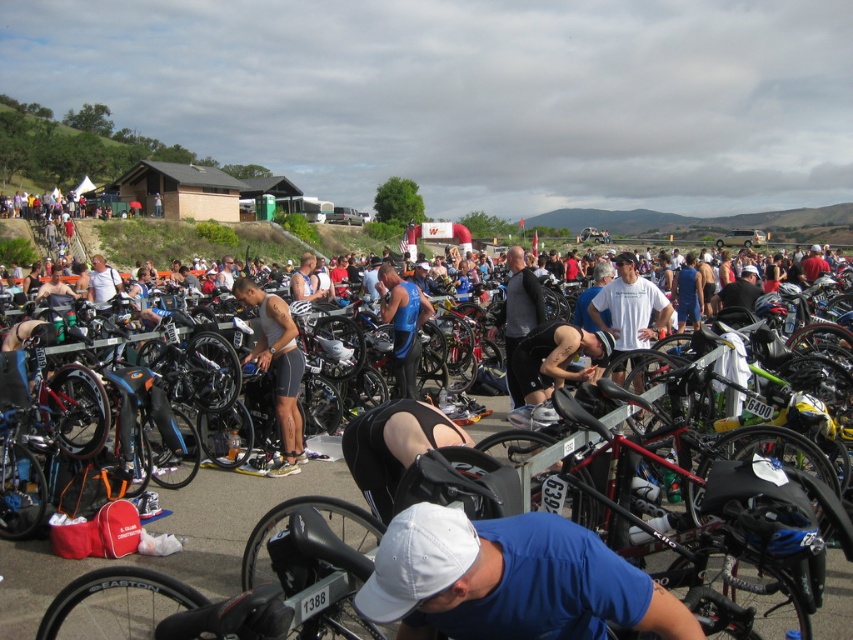
Does gray matte shorts at center have a larger size compared to black matte vest at center?

No.

Is point (268, 362) farther from viewer compared to point (511, 308)?

No.

This screenshot has width=853, height=640. Find the location of `gray matte shorts at center`. gray matte shorts at center is located at coordinates (277, 368).

This screenshot has width=853, height=640. Identify the location of gray matte shorts at center. (277, 368).

Between black matte helmet at center and black matte vest at center, which one has more height?

black matte vest at center is taller.

Is black matte helmet at center further to camera compared to black matte vest at center?

No, it is not.

Which is behind, point (364, 420) or point (518, 273)?

The point (518, 273) is behind.

Identify the location of black matte helmet at center. (393, 445).

Is point (524, 579) positioned behind point (397, 388)?

No.

Does blue fabric shirt at center have a greater width compared to blue fabric tank top at center?

Yes, blue fabric shirt at center is wider than blue fabric tank top at center.

Does point (520, 566) lie behind point (413, 387)?

No, it is in front of (413, 387).

Image resolution: width=853 pixels, height=640 pixels. I want to click on blue fabric shirt at center, so click(509, 580).